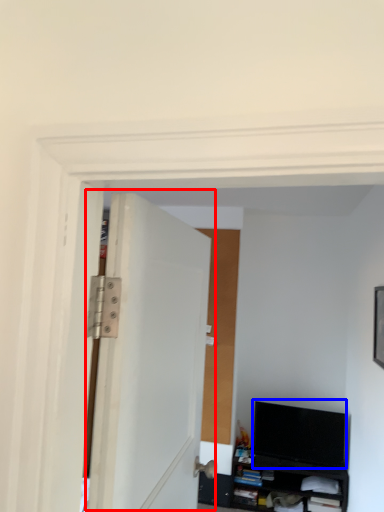
Question: Which object is closer to the camera taking this photo, door (highlighted by a red box) or computer monitor (highlighted by a blue box)?

Choices:
 (A) door
 (B) computer monitor

Answer: (A)